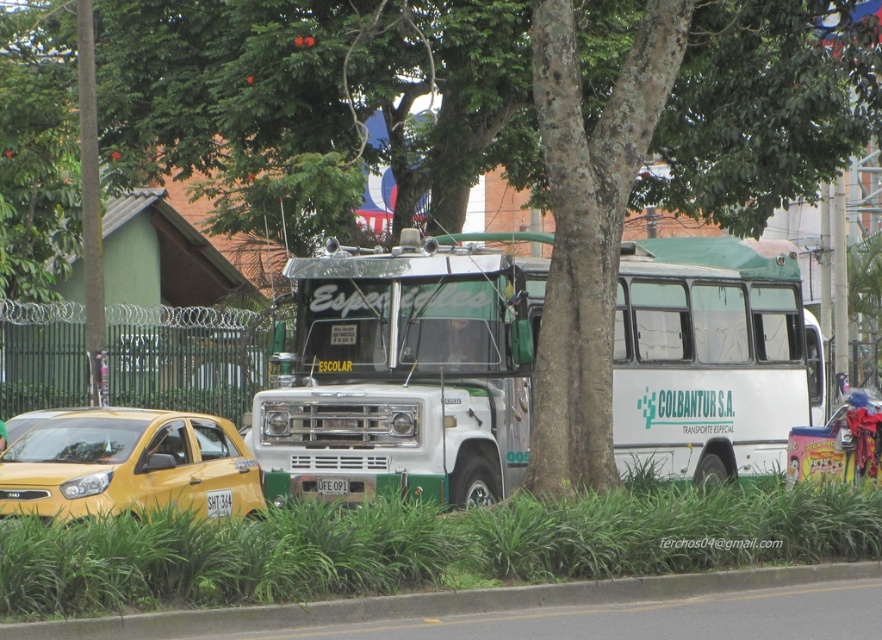
Does yellow matte taxi at lower left have a lesser height compared to gray concrete curb at lower center?

No.

Can you confirm if yellow matte taxi at lower left is positioned below gray concrete curb at lower center?

Incorrect, yellow matte taxi at lower left is not positioned below gray concrete curb at lower center.

Is point (88, 513) less distant than point (16, 621)?

No.

You are a GUI agent. You are given a task and a screenshot of the screen. Output one action in this format:
    pyautogui.click(x=<x>, y=<y>)
    Task: Click on the yellow matte taxi at lower left
    This screenshot has height=640, width=882.
    Given the screenshot: What is the action you would take?
    pyautogui.click(x=126, y=464)

Between white plastic license plate at center and white matte license plate at center, which one appears on the right side from the viewer's perspective?

Positioned to the right is white matte license plate at center.

Who is shorter, white plastic license plate at center or white matte license plate at center?

white matte license plate at center

Does point (217, 497) come farther from viewer compared to point (319, 481)?

That is False.

Where is `white plastic license plate at center`? The height and width of the screenshot is (640, 882). white plastic license plate at center is located at coordinates (218, 502).

The image size is (882, 640). Find the location of `yellow matte taxi at lower left`. yellow matte taxi at lower left is located at coordinates (126, 464).

Can you confirm if yellow matte taxi at lower left is wider than white plastic license plate at center?

Indeed, yellow matte taxi at lower left has a greater width compared to white plastic license plate at center.

Between point (66, 484) and point (228, 500), which one is positioned in front?

Positioned in front is point (66, 484).

Where is `yellow matte taxi at lower left`? yellow matte taxi at lower left is located at coordinates (126, 464).